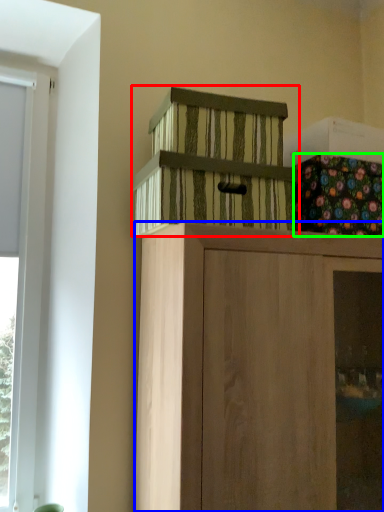
Question: Based on their relative distances, which object is nearer to cabinetry (highlighted by a red box)? Choose from cabinetry (highlighted by a blue box) and flower (highlighted by a green box).

Choices:
 (A) cabinetry
 (B) flower

Answer: (B)